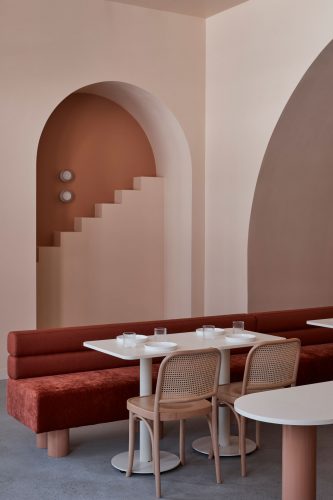
Locate an element on the screen. The width and height of the screenshot is (333, 500). bench is located at coordinates (93, 401).